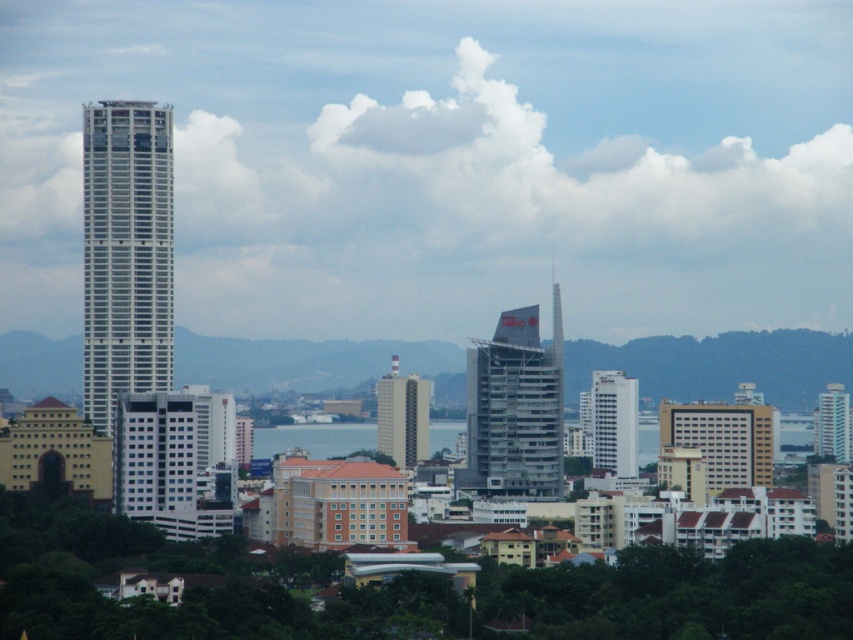
Can you confirm if white glass tower at left is wider than white glossy building at center?

Indeed, white glass tower at left has a greater width compared to white glossy building at center.

Which is more to the right, white glass tower at left or white glossy building at center?

From the viewer's perspective, white glossy building at center appears more on the right side.

At what (x,y) coordinates should I click in order to perform the action: click on white glass tower at left. Please return your answer as a coordinate pair (x, y). The width and height of the screenshot is (853, 640). Looking at the image, I should click on (126, 253).

Between white glass tower at left and matte beige building at center, which one appears on the left side from the viewer's perspective?

white glass tower at left

Is white glass tower at left further to the viewer compared to matte beige building at center?

Yes.

Identify the location of white glass tower at left. The width and height of the screenshot is (853, 640). (126, 253).

Which is above, metallic glass skyscraper at center or blue water at center?

metallic glass skyscraper at center is higher up.

Who is more forward, (480, 429) or (306, 435)?

Point (480, 429) is in front.

Is point (477, 454) closer to camera compared to point (369, 436)?

No, (477, 454) is further to viewer.

This screenshot has height=640, width=853. I want to click on metallic glass skyscraper at center, so click(515, 410).